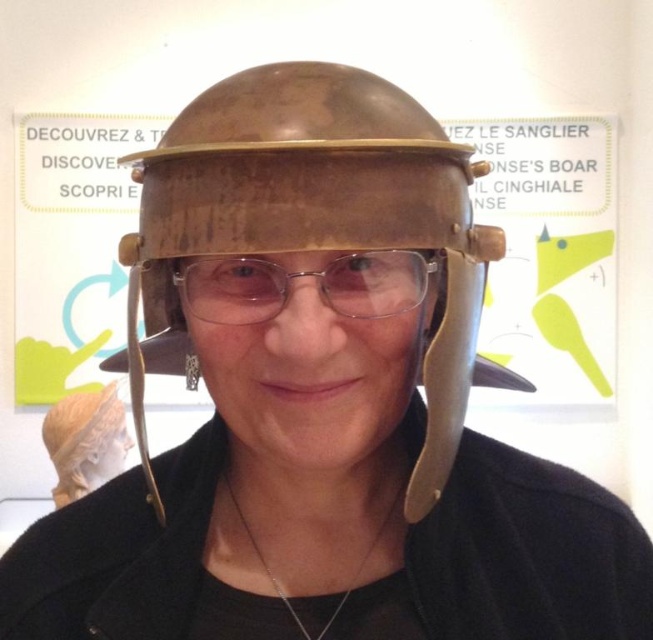
Can you confirm if metallic sign at upper center is bigger than silver chain at center?

Yes.

Is point (562, 364) less distant than point (325, 627)?

No, it is behind (325, 627).

The height and width of the screenshot is (640, 653). Identify the location of metallic sign at upper center. (549, 252).

Measure the distance between rusty metal helmet at center and metallic/transparent glasses at center.

They are 2.30 inches apart.

Who is lower down, rusty metal helmet at center or metallic/transparent glasses at center?

Positioned lower is rusty metal helmet at center.

Is point (464, 368) farther from camera compared to point (338, 301)?

Yes, point (464, 368) is behind point (338, 301).

Find the location of a particular element. rusty metal helmet at center is located at coordinates (311, 232).

Between metallic sign at upper center and matte gold helmet at center, which one has more height?

metallic sign at upper center is taller.

Who is positioned more to the left, metallic sign at upper center or matte gold helmet at center?

From the viewer's perspective, matte gold helmet at center appears more on the left side.

Does point (518, 317) come behind point (99, 412)?

Yes, it is.

You are a GUI agent. You are given a task and a screenshot of the screen. Output one action in this format:
    pyautogui.click(x=<x>, y=<y>)
    Task: Click on the metallic sign at upper center
    The height and width of the screenshot is (640, 653).
    Given the screenshot: What is the action you would take?
    pyautogui.click(x=549, y=252)